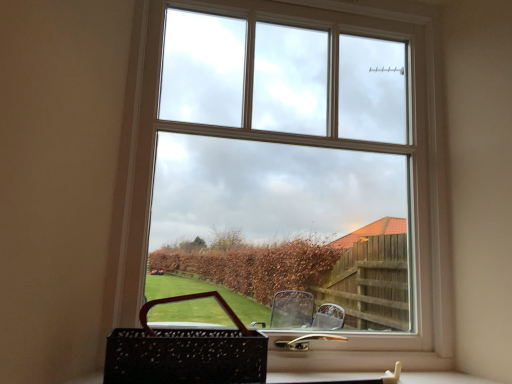
Locate an element on the screen. This screenshot has height=384, width=512. empty space that is ontop of transparent glass window at center (from a real-world perspective) is located at coordinates (342, 9).